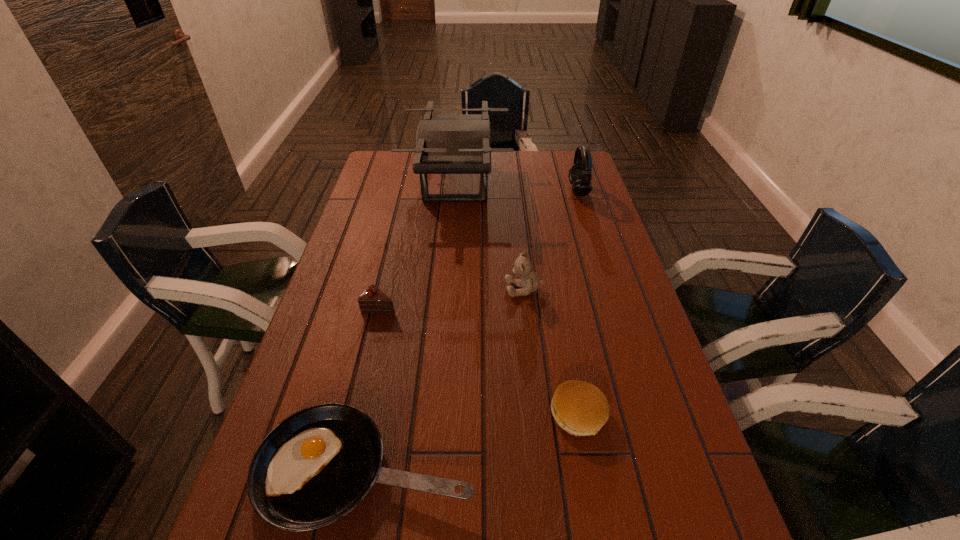
Choose which object is the second nearest neighbor to the frying pan. Please provide its 2D coordinates. Your answer should be formatted as a tuple, i.e. [(x, y)], where the tuple contains the x and y coordinates of a point satisfying the conditions above.

[(372, 300)]

Identify which object is the closest to the teddy bear. Please provide its 2D coordinates. Your answer should be formatted as a tuple, i.e. [(x, y)], where the tuple contains the x and y coordinates of a point satisfying the conditions above.

[(445, 143)]

Where is `vacant area in the image that satisfies the following two spatial constraints: 1. with a camera mounted on the underside of the drone; 2. on the back side of the patty`? This screenshot has height=540, width=960. vacant area in the image that satisfies the following two spatial constraints: 1. with a camera mounted on the underside of the drone; 2. on the back side of the patty is located at coordinates (439, 414).

The image size is (960, 540). Identify the location of vacant space that satisfies the following two spatial constraints: 1. on the face of the teddy bear; 2. on the right side of the patty. (538, 414).

Where is `free space that satisfies the following two spatial constraints: 1. on the face of the patty; 2. on the right side of the third tallest object`? This screenshot has height=540, width=960. free space that satisfies the following two spatial constraints: 1. on the face of the patty; 2. on the right side of the third tallest object is located at coordinates pos(538,414).

Where is `vacant region that satisfies the following two spatial constraints: 1. on the back side of the patty; 2. with a camera mounted on the underside of the drone`? The width and height of the screenshot is (960, 540). vacant region that satisfies the following two spatial constraints: 1. on the back side of the patty; 2. with a camera mounted on the underside of the drone is located at coordinates (536, 183).

Image resolution: width=960 pixels, height=540 pixels. What are the coordinates of `blank area in the image that satisfies the following two spatial constraints: 1. with a camera mounted on the underside of the tallest object; 2. on the front side of the frying pan` in the screenshot? It's located at (435, 469).

Find the location of `free location that satisfies the following two spatial constraints: 1. with a camera mounted on the underside of the patty; 2. on the left side of the tallest object`. free location that satisfies the following two spatial constraints: 1. with a camera mounted on the underside of the patty; 2. on the left side of the tallest object is located at coordinates (439, 414).

This screenshot has width=960, height=540. I want to click on vacant space that satisfies the following two spatial constraints: 1. on the face of the patty; 2. on the right side of the fourth shortest object, so click(538, 414).